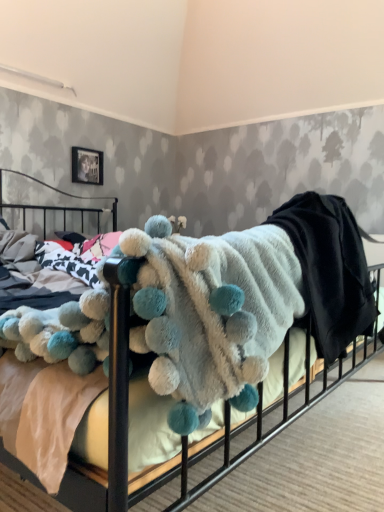
Question: From a real-world perspective, is fluffy white blanket at center on metallic silver picture frame at upper left?

Choices:
 (A) yes
 (B) no

Answer: (B)

Question: Does fluffy white blanket at center have a larger size compared to metallic silver picture frame at upper left?

Choices:
 (A) yes
 (B) no

Answer: (A)

Question: Is fluffy white blanket at center oriented away from metallic silver picture frame at upper left?

Choices:
 (A) yes
 (B) no

Answer: (A)

Question: Can you confirm if fluffy white blanket at center is thinner than metallic silver picture frame at upper left?

Choices:
 (A) yes
 (B) no

Answer: (B)

Question: From a real-world perspective, is fluffy white blanket at center located beneath metallic silver picture frame at upper left?

Choices:
 (A) no
 (B) yes

Answer: (B)

Question: Does fluffy white blanket at center appear on the right side of metallic silver picture frame at upper left?

Choices:
 (A) no
 (B) yes

Answer: (B)

Question: Is metallic silver picture frame at upper left beside fluffy white blanket with blue pom-poms at center?

Choices:
 (A) no
 (B) yes

Answer: (A)

Question: Is metallic silver picture frame at upper left facing away from fluffy white blanket with blue pom-poms at center?

Choices:
 (A) no
 (B) yes

Answer: (A)

Question: From a real-world perspective, is metallic silver picture frame at upper left positioned over fluffy white blanket with blue pom-poms at center based on gravity?

Choices:
 (A) no
 (B) yes

Answer: (B)

Question: Can you confirm if metallic silver picture frame at upper left is bigger than fluffy white blanket with blue pom-poms at center?

Choices:
 (A) no
 (B) yes

Answer: (A)

Question: Is metallic silver picture frame at upper left to the left of fluffy white blanket with blue pom-poms at center from the viewer's perspective?

Choices:
 (A) yes
 (B) no

Answer: (A)

Question: Is metallic silver picture frame at upper left smaller than fluffy white blanket with blue pom-poms at center?

Choices:
 (A) yes
 (B) no

Answer: (A)

Question: Is metallic silver picture frame at upper left a part of fluffy white blanket with blue pom-poms at center?

Choices:
 (A) no
 (B) yes

Answer: (A)